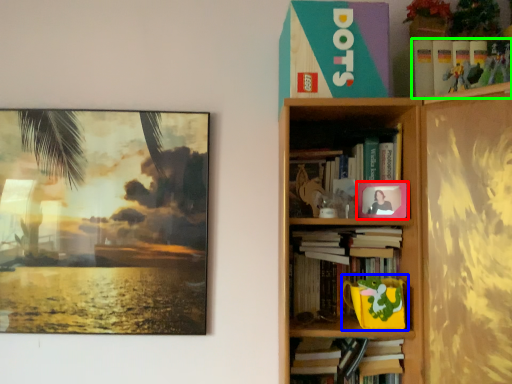
Question: Considering the real-world distances, which object is farthest from picture frame (highlighted by a red box)? toy (highlighted by a blue box) or book (highlighted by a green box)?

Choices:
 (A) toy
 (B) book

Answer: (B)